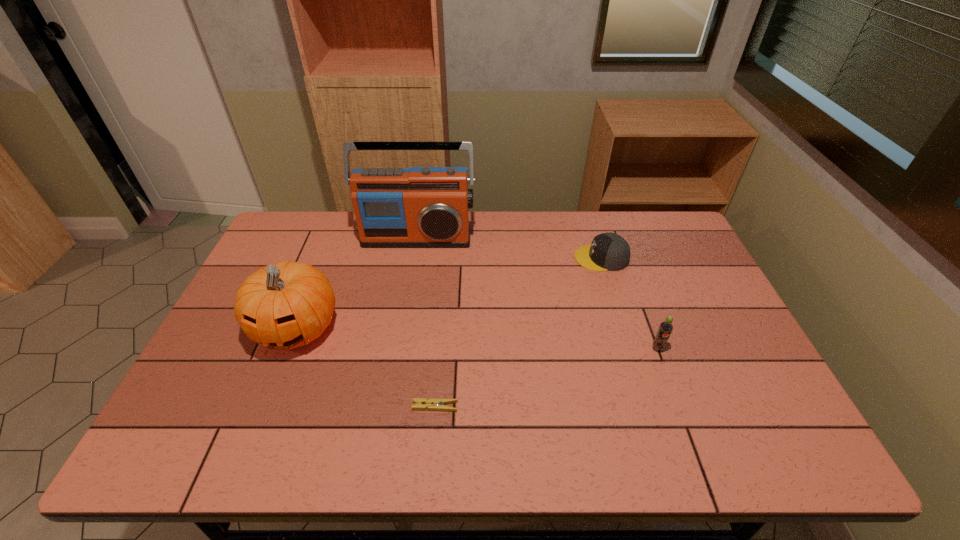
Where is `radio receiver`? radio receiver is located at coordinates (419, 207).

Image resolution: width=960 pixels, height=540 pixels. What are the coordinates of `pumpkin` in the screenshot? It's located at (285, 305).

Locate an element on the screen. the third tallest object is located at coordinates (666, 327).

Locate an element on the screen. The width and height of the screenshot is (960, 540). cap is located at coordinates click(608, 251).

This screenshot has height=540, width=960. In order to click on the shortest object in this screenshot , I will do `click(419, 403)`.

Locate an element on the screen. the nearest object is located at coordinates (419, 403).

Where is `vacant region located 0.180m on the front-facing side of the tallest object`? vacant region located 0.180m on the front-facing side of the tallest object is located at coordinates click(408, 288).

You are a GUI agent. You are given a task and a screenshot of the screen. Output one action in this format:
    pyautogui.click(x=<x>, y=<y>)
    Task: Click on the vacant area situated 0.160m on the front-facing side of the second tallest object
    This screenshot has width=960, height=540.
    Given the screenshot: What is the action you would take?
    point(260,421)

The width and height of the screenshot is (960, 540). What are the coordinates of `vacant region located 0.200m on the front label of the soda` in the screenshot? It's located at (684, 423).

Where is `free space located on the front-facing side of the fourth tallest object`? The image size is (960, 540). free space located on the front-facing side of the fourth tallest object is located at coordinates (471, 258).